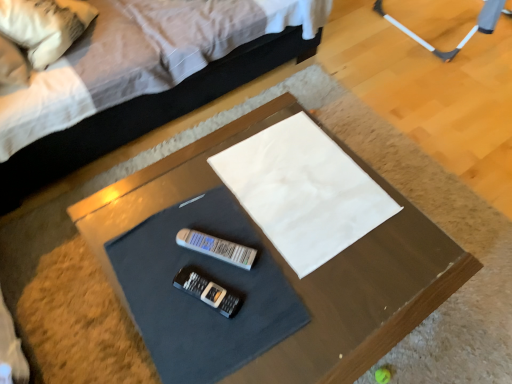
Question: From a real-world perspective, is white fabric pillow at upper left on smooth brown table at center?

Choices:
 (A) no
 (B) yes

Answer: (B)

Question: Could you tell me if white fabric pillow at upper left is facing smooth brown table at center?

Choices:
 (A) yes
 (B) no

Answer: (B)

Question: From a real-world perspective, is white fabric pillow at upper left positioned under smooth brown table at center based on gravity?

Choices:
 (A) no
 (B) yes

Answer: (A)

Question: Can smooth brown table at center be found inside white fabric pillow at upper left?

Choices:
 (A) no
 (B) yes

Answer: (A)

Question: Can you confirm if white fabric pillow at upper left is taller than smooth brown table at center?

Choices:
 (A) no
 (B) yes

Answer: (B)

Question: Is smooth brown table at center taller or shorter than white fabric pillow at upper left?

Choices:
 (A) tall
 (B) short

Answer: (B)

Question: From a real-world perspective, is smooth brown table at center physically located above or below white fabric pillow at upper left?

Choices:
 (A) below
 (B) above

Answer: (A)

Question: Which is correct: smooth brown table at center is inside white fabric pillow at upper left, or outside of it?

Choices:
 (A) outside
 (B) inside

Answer: (A)

Question: Looking at their shapes, would you say smooth brown table at center is wider or thinner than white fabric pillow at upper left?

Choices:
 (A) wide
 (B) thin

Answer: (A)

Question: From their relative heights in the image, would you say smooth brown table at center is taller or shorter than white fabric bed at upper center?

Choices:
 (A) tall
 (B) short

Answer: (B)

Question: Considering the positions of point (150, 210) and point (155, 82), is point (150, 210) closer or farther from the camera than point (155, 82)?

Choices:
 (A) farther
 (B) closer

Answer: (B)

Question: Relative to white fabric bed at upper center, is smooth brown table at center in front or behind?

Choices:
 (A) behind
 (B) front

Answer: (B)

Question: Which is correct: smooth brown table at center is inside white fabric bed at upper center, or outside of it?

Choices:
 (A) outside
 (B) inside

Answer: (A)

Question: Looking at the image, does white fabric pillow at upper left seem bigger or smaller compared to smooth brown table at center?

Choices:
 (A) big
 (B) small

Answer: (B)

Question: In the image, is white fabric pillow at upper left positioned in front of or behind smooth brown table at center?

Choices:
 (A) front
 (B) behind

Answer: (B)